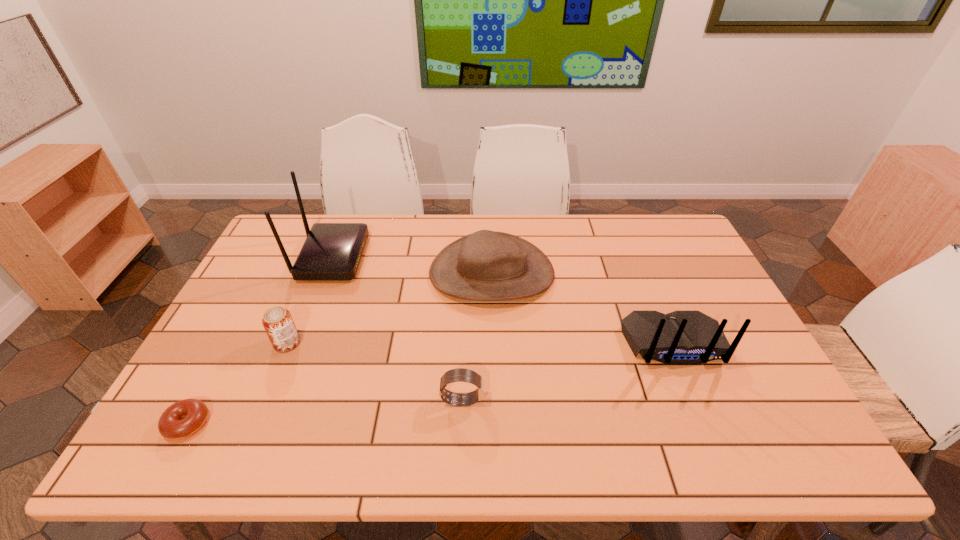
The width and height of the screenshot is (960, 540). Identify the location of vacant space that is in between the cowboy hat and the left router. (412, 265).

You are a GUI agent. You are given a task and a screenshot of the screen. Output one action in this format:
    pyautogui.click(x=<x>, y=<y>)
    Task: Click on the vacant area that lies between the left router and the beer can
    
    Given the screenshot: What is the action you would take?
    pyautogui.click(x=309, y=300)

What are the coordinates of `free point between the watch and the cowboy hat` in the screenshot? It's located at (477, 336).

You are a GUI agent. You are given a task and a screenshot of the screen. Output one action in this format:
    pyautogui.click(x=<x>, y=<y>)
    Task: Click on the free space between the shorter router and the leftmost object
    The height and width of the screenshot is (540, 960).
    Given the screenshot: What is the action you would take?
    pyautogui.click(x=430, y=383)

Locate which object is the closest to the cowboy hat. Please provide its 2D coordinates. Your answer should be formatted as a tuple, i.e. [(x, y)], where the tuple contains the x and y coordinates of a point satisfying the conditions above.

[(681, 337)]

Locate an element on the screen. The image size is (960, 540). object that stands as the closest to the shortest object is located at coordinates (277, 321).

I want to click on vacant region that satisfies the following two spatial constraints: 1. on the front-facing side of the cowboy hat; 2. on the right side of the tallest object, so click(325, 273).

Where is `free location that satisfies the following two spatial constraints: 1. on the back of the second tallest object; 2. on the face of the watch`? free location that satisfies the following two spatial constraints: 1. on the back of the second tallest object; 2. on the face of the watch is located at coordinates (696, 400).

At what (x,y) coordinates should I click in order to perform the action: click on vacant region that satisfies the following two spatial constraints: 1. on the back side of the cowboy hat; 2. on the right side of the shortest object. Please return your answer as a coordinate pair (x, y). Image resolution: width=960 pixels, height=540 pixels. Looking at the image, I should click on (268, 273).